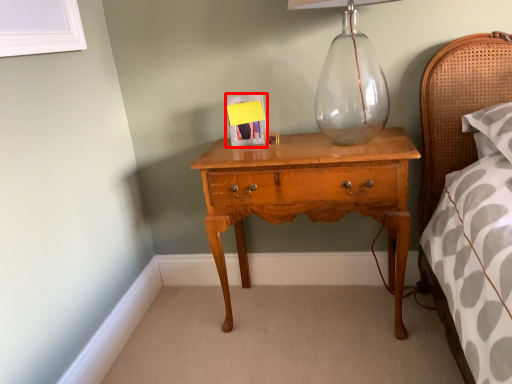
Question: In this image, where is picture frame (annotated by the red box) located relative to nightstand?

Choices:
 (A) left
 (B) right

Answer: (A)